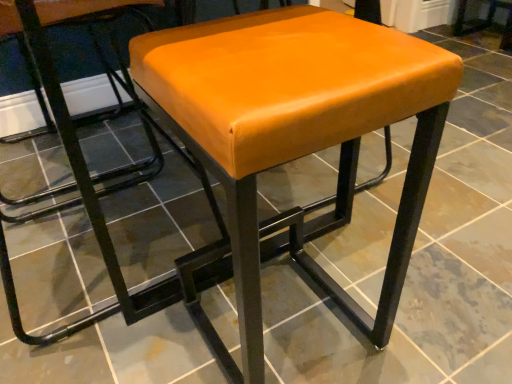
Measure the distance between orange leather stool at center and camera.

A distance of 43.10 centimeters exists between orange leather stool at center and camera.

Locate an element on the screen. The image size is (512, 384). orange leather stool at center is located at coordinates (296, 134).

Measure the distance between point (x=252, y=40) and camera.

The depth of point (x=252, y=40) is 62.10 centimeters.

What do you see at coordinates (296, 134) in the screenshot? The width and height of the screenshot is (512, 384). I see `orange leather stool at center` at bounding box center [296, 134].

At what (x,y) coordinates should I click in order to perform the action: click on orange leather stool at center. Please return your answer as a coordinate pair (x, y). The width and height of the screenshot is (512, 384). Looking at the image, I should click on (296, 134).